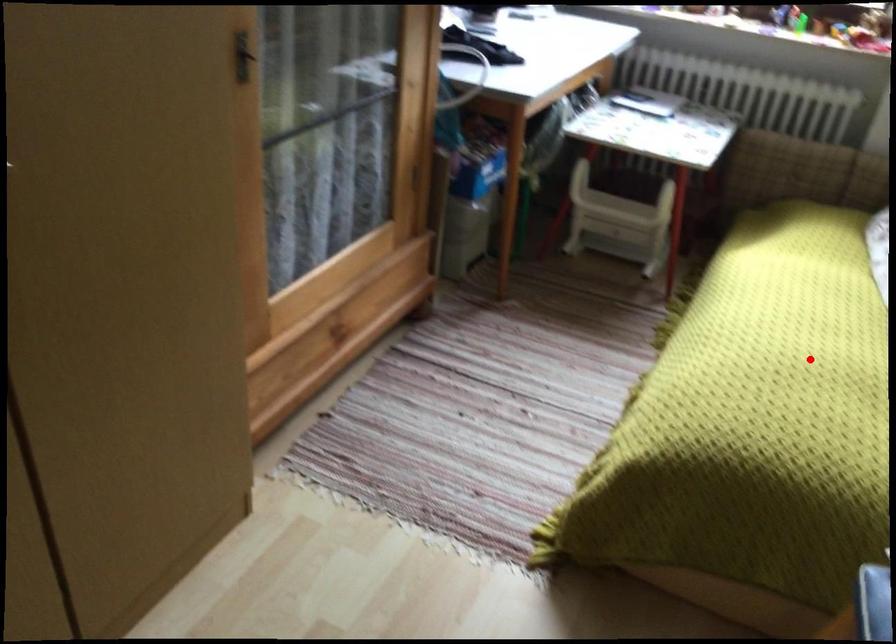
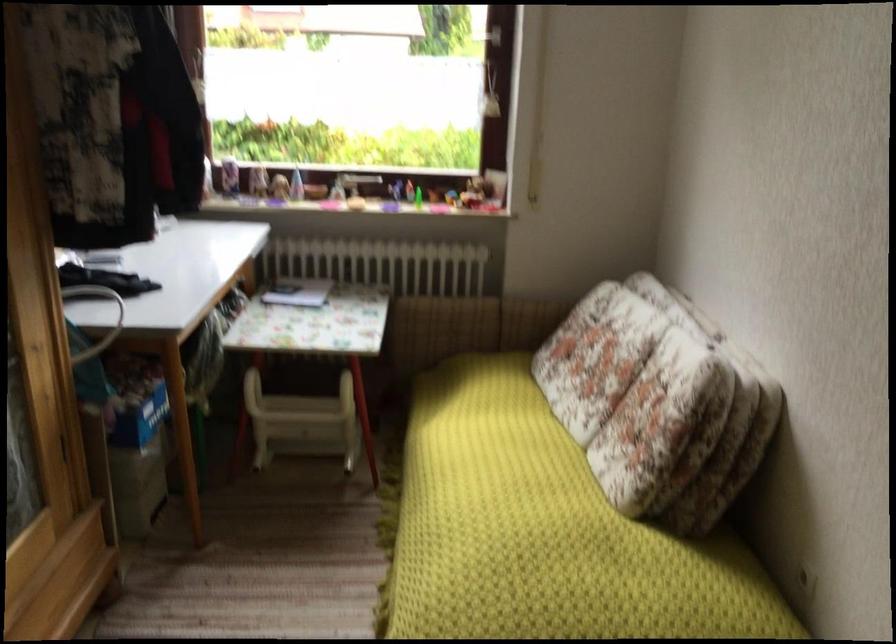
The point at the highlighted location is marked in the first image. Where is the corresponding point in the second image?

(544, 532)